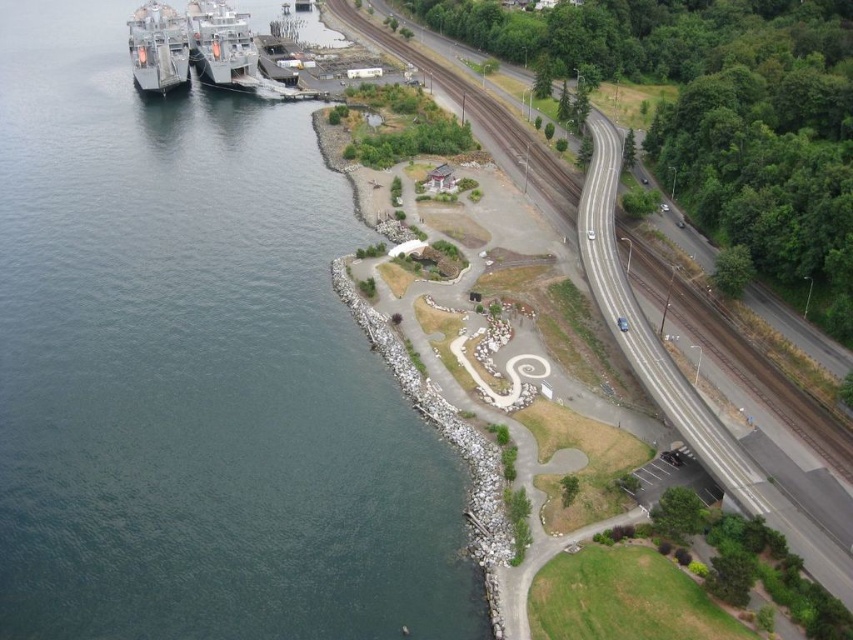
You are a photographer planning to capture both the metallic gray ship at upper left and the metallic gray ship at left in a single aerial shot. Considering their sizes, which ship will appear smaller in the final photograph?

The metallic gray ship at upper left will appear smaller in the final photograph because it has a smaller size compared to the metallic gray ship at left.

You are a drone operator tasked with navigating a small drone from the paved road to the dark blue water at left. The drone has a GPS marker at point (x=195, y=371). Is this point on the dark blue water at left?

Yes, the point (x=195, y=371) is on the dark blue water at left, so the drone can navigate directly to that location.

You are a drone operator tasked with capturing aerial footage of the coastal area. You need to ensure that the dark blue water at left and the metallic gray ship at left are both visible in the frame. Based on their relative widths, is there enough space in the frame to include both objects without cropping either of them?

The dark blue water at left is wider than the metallic gray ship at left, so there is sufficient space in the frame to include both objects without cropping either of them.